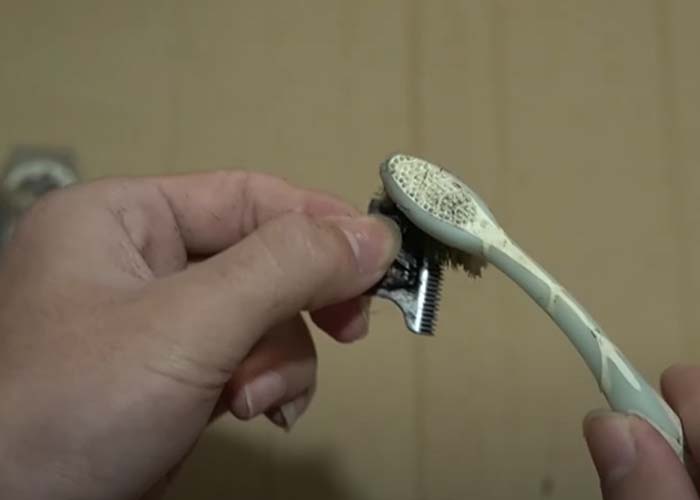
You are a GUI agent. You are given a task and a screenshot of the screen. Output one action in this format:
    pyautogui.click(x=<x>, y=<y>)
    Task: Click on the wall
    This screenshot has width=700, height=500.
    Given the screenshot: What is the action you would take?
    pyautogui.click(x=113, y=81), pyautogui.click(x=631, y=113)